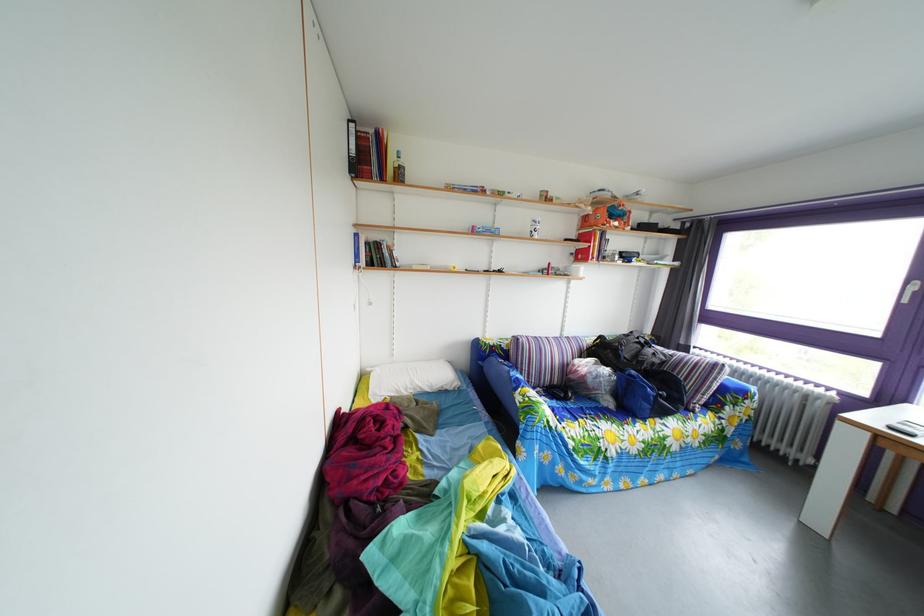
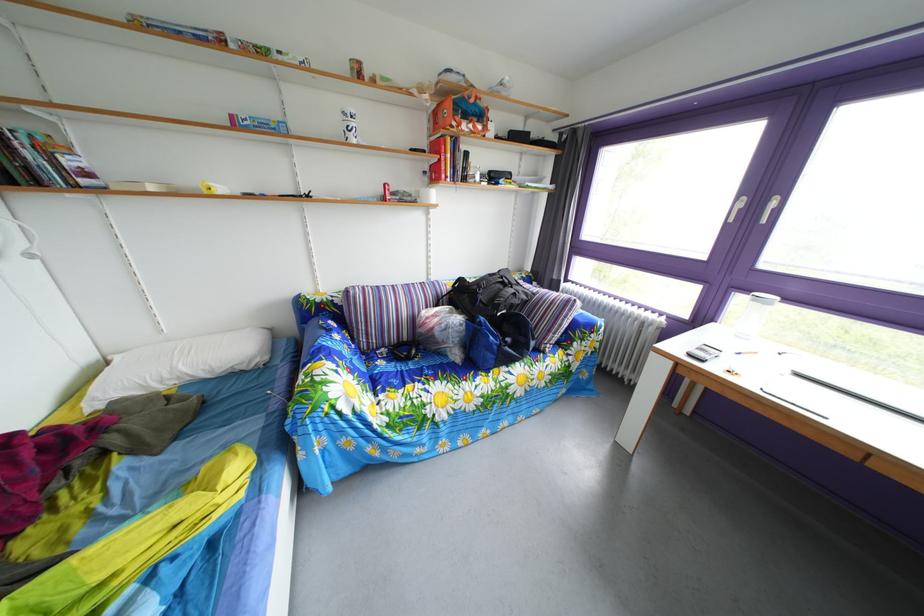
Question: Based on the continuous images, in which direction is the camera rotating? Reply with the corresponding letter.

Choices:
 (A) Left
 (B) Right
 (C) Up
 (D) Down

Answer: (D)